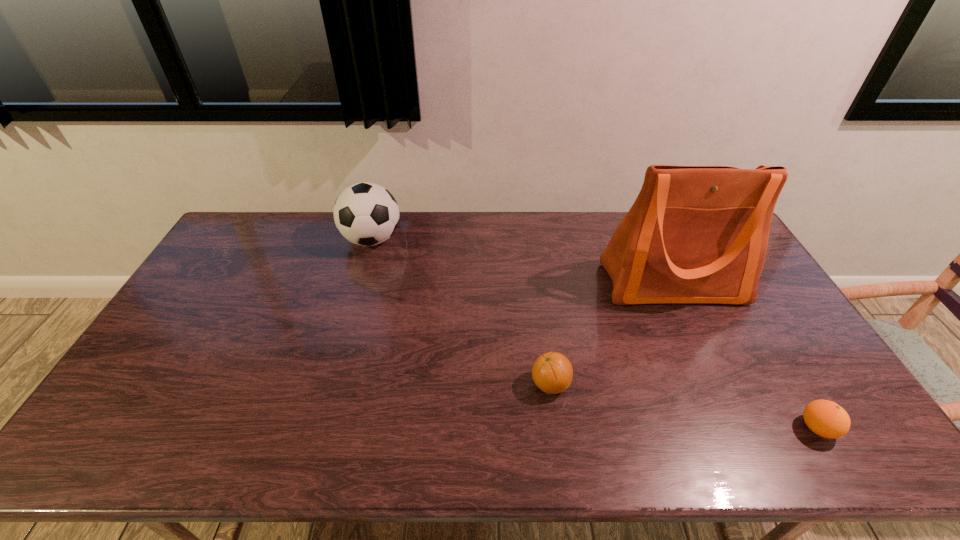
You are a GUI agent. You are given a task and a screenshot of the screen. Output one action in this format:
    pyautogui.click(x=<x>, y=<y>)
    Task: Click on the free space that is in between the shorter orange and the tallest object
    The height and width of the screenshot is (540, 960).
    Given the screenshot: What is the action you would take?
    pyautogui.click(x=745, y=356)

Find the location of a particular element. The width and height of the screenshot is (960, 540). vacant space that's between the nearer orange and the leftmost object is located at coordinates (594, 334).

Identify the location of empty space between the taller orange and the soccer ball. click(x=461, y=312).

At what (x,y) coordinates should I click in order to perform the action: click on blank region between the leftmost object and the shopping bag. Please return your answer as a coordinate pair (x, y). Looking at the image, I should click on (522, 261).

In order to click on vacant area between the nearest object and the tallest object in this screenshot , I will do `click(745, 356)`.

Locate an element on the screen. This screenshot has width=960, height=540. free space between the third shortest object and the third tallest object is located at coordinates (461, 312).

Identify the location of vacant space that is in between the shorter orange and the shopping bag. (745, 356).

At what (x,y) coordinates should I click in order to perform the action: click on free spot between the third shortest object and the third object from right to left. Please return your answer as a coordinate pair (x, y). The width and height of the screenshot is (960, 540). Looking at the image, I should click on (461, 312).

You are a GUI agent. You are given a task and a screenshot of the screen. Output one action in this format:
    pyautogui.click(x=<x>, y=<y>)
    Task: Click on the free point between the tallest object and the shortest object
    
    Given the screenshot: What is the action you would take?
    pyautogui.click(x=745, y=356)

Locate an element on the screen. The height and width of the screenshot is (540, 960). object identified as the third closest to the second object from left to right is located at coordinates (367, 214).